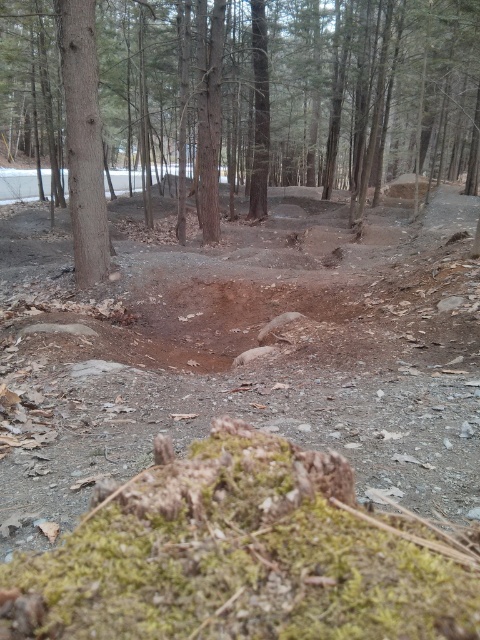
Is brown dirt track at center smaller than brown rough tree trunk at left?

No, brown dirt track at center is not smaller than brown rough tree trunk at left.

Which of these two, brown dirt track at center or brown rough tree trunk at left, stands taller?

With more height is brown rough tree trunk at left.

Locate an element on the screen. The height and width of the screenshot is (640, 480). brown dirt track at center is located at coordinates (277, 404).

The image size is (480, 640). What do you see at coordinates (334, 96) in the screenshot? I see `brown textured dirt at center` at bounding box center [334, 96].

Who is positioned more to the right, brown textured dirt at center or brown rough tree trunk at left?

brown textured dirt at center is more to the right.

Is point (19, 99) positioned after point (94, 196)?

Yes, it is behind point (94, 196).

Locate an element on the screen. This screenshot has width=480, height=640. brown textured dirt at center is located at coordinates (334, 96).

Who is positioned more to the right, brown textured dirt at center or brown dirt track at center?

Positioned to the right is brown textured dirt at center.

Is brown textured dirt at center positioned at the back of brown dirt track at center?

That is True.

Does point (95, 237) come behind point (418, 429)?

Yes.

This screenshot has height=640, width=480. Identify the location of brown textured dirt at center. (334, 96).